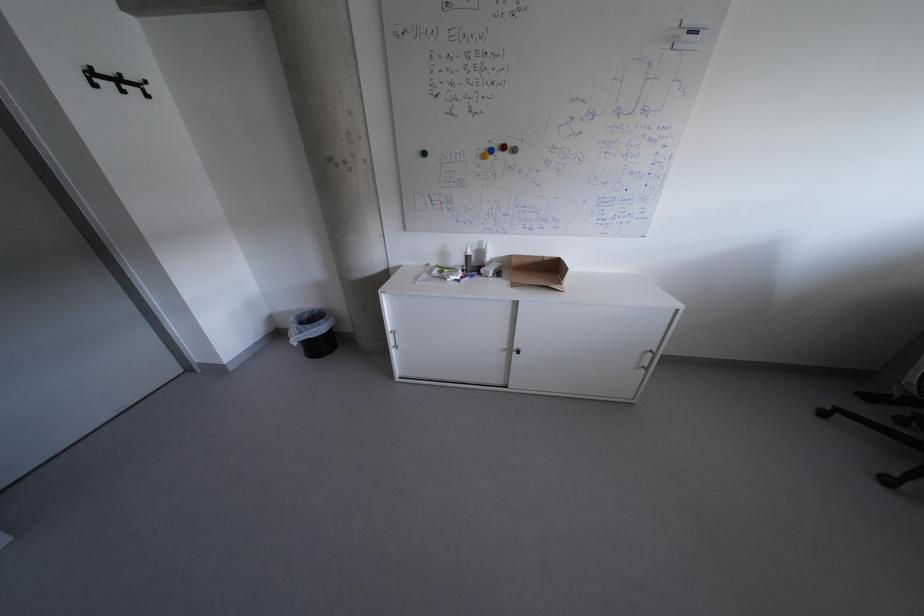
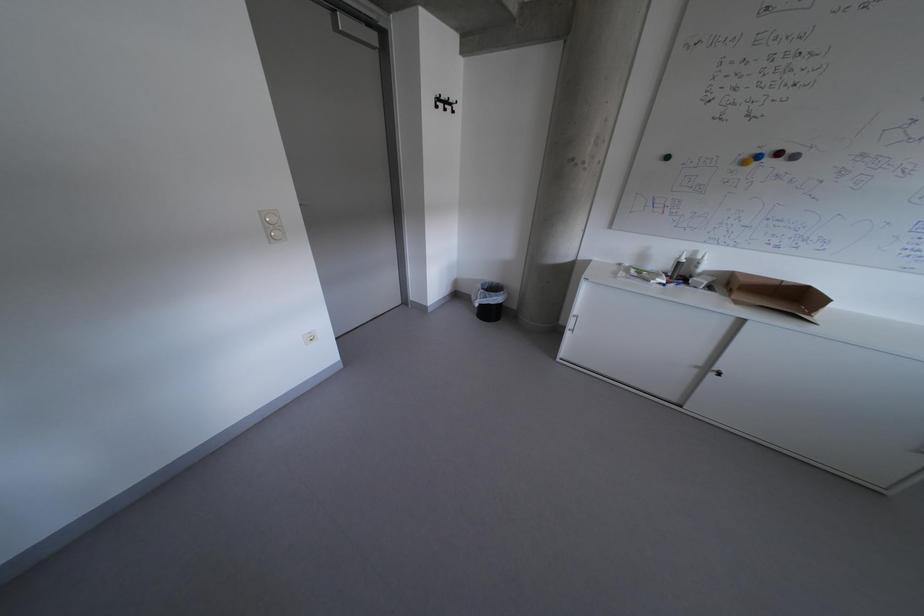
In a continuous first-person perspective shot, in which direction is the camera moving?

The cameraman moved toward left, backward.